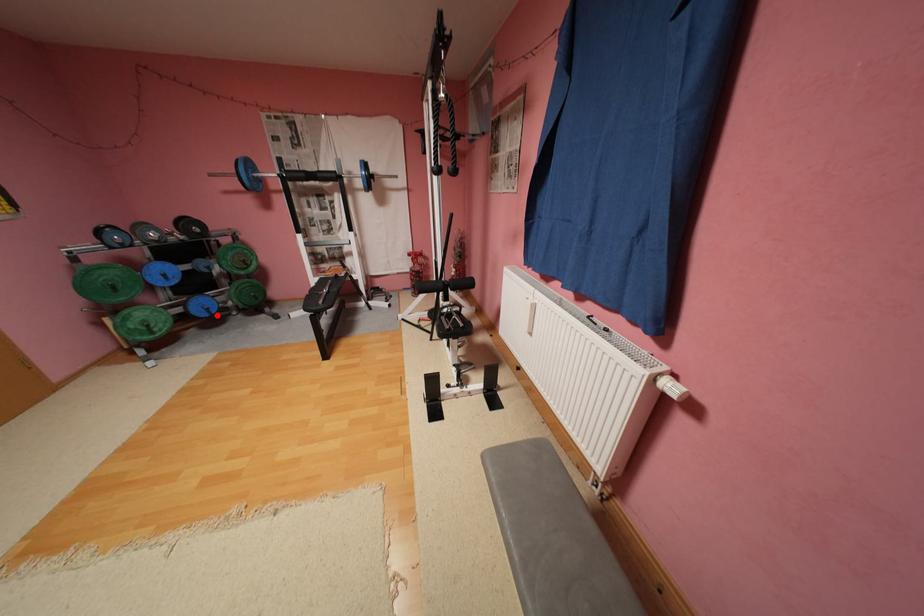
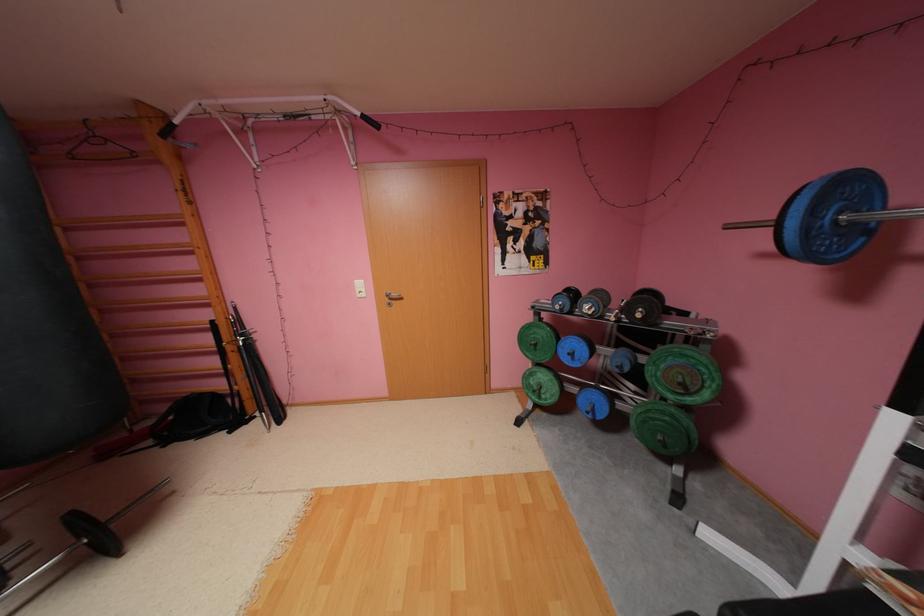
In the second image, find the point that corresponds to the highlighted location in the first image.

(600, 416)